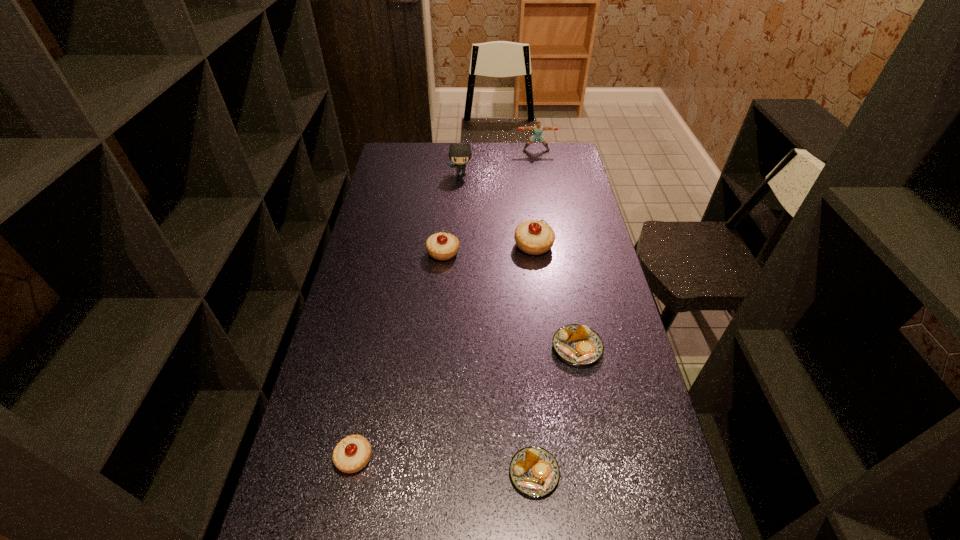
Find the location of a particular element. The image size is (960, 540). the second shortest pastry is located at coordinates (579, 345).

Where is `the third farthest pastry`? The width and height of the screenshot is (960, 540). the third farthest pastry is located at coordinates (579, 345).

Identify the location of the smaller brown pastry. (534, 471).

In order to click on the shortest object in this screenshot , I will do `click(534, 471)`.

The image size is (960, 540). Find the location of `vacant region located 0.070m on the front-facing side of the red puncher`. vacant region located 0.070m on the front-facing side of the red puncher is located at coordinates (538, 160).

Find the location of a particular element. vacant position located 0.300m on the front-facing side of the second farthest object is located at coordinates (458, 220).

I want to click on vacant space situated on the back of the biggest beige pastry, so click(x=529, y=206).

You are a GUI agent. You are given a task and a screenshot of the screen. Output one action in this format:
    pyautogui.click(x=<x>, y=<y>)
    Task: Click on the vacant space positioned 0.120m on the front of the second tallest pastry
    Image resolution: width=960 pixels, height=540 pixels.
    Given the screenshot: What is the action you would take?
    pyautogui.click(x=441, y=288)

Locate an element on the screen. Image resolution: width=960 pixels, height=540 pixels. blank space located 0.090m on the right of the leftmost beige pastry is located at coordinates (410, 458).

The height and width of the screenshot is (540, 960). In order to click on vacant space located 0.180m on the front of the second shortest pastry in this screenshot , I will do `click(592, 429)`.